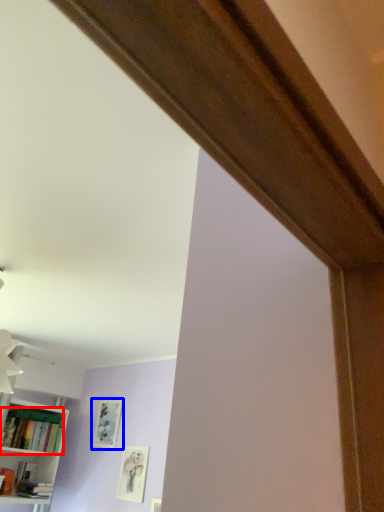
Question: Among these objects, which one is nearest to the camera, book (highlighted by a red box) or picture frame (highlighted by a blue box)?

Choices:
 (A) book
 (B) picture frame

Answer: (A)